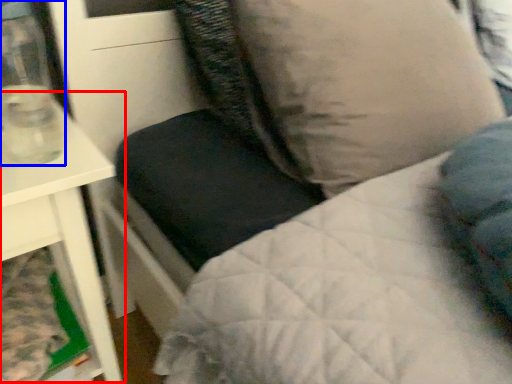
Question: Which point is further to the camera, table (highlighted by a red box) or glass vase (highlighted by a blue box)?

Choices:
 (A) table
 (B) glass vase

Answer: (A)